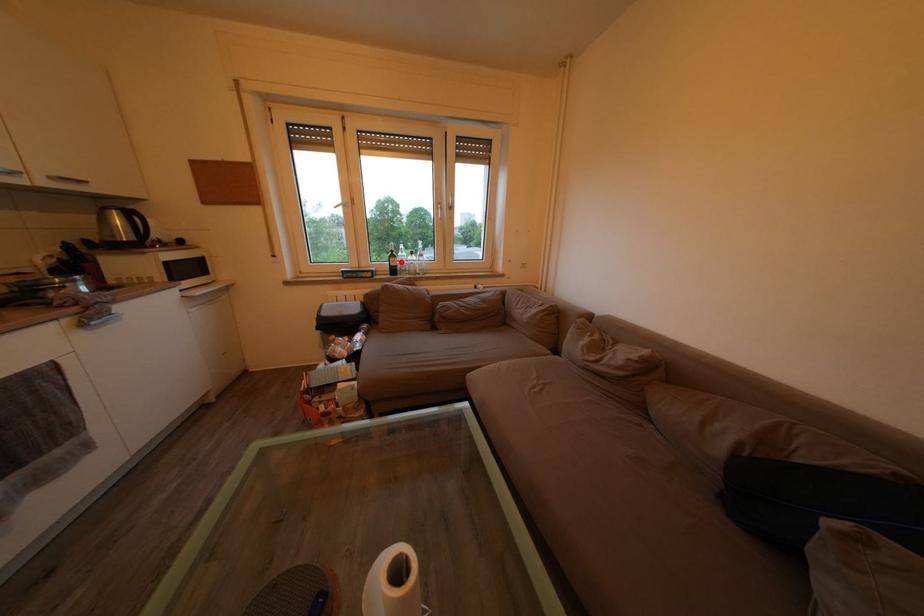
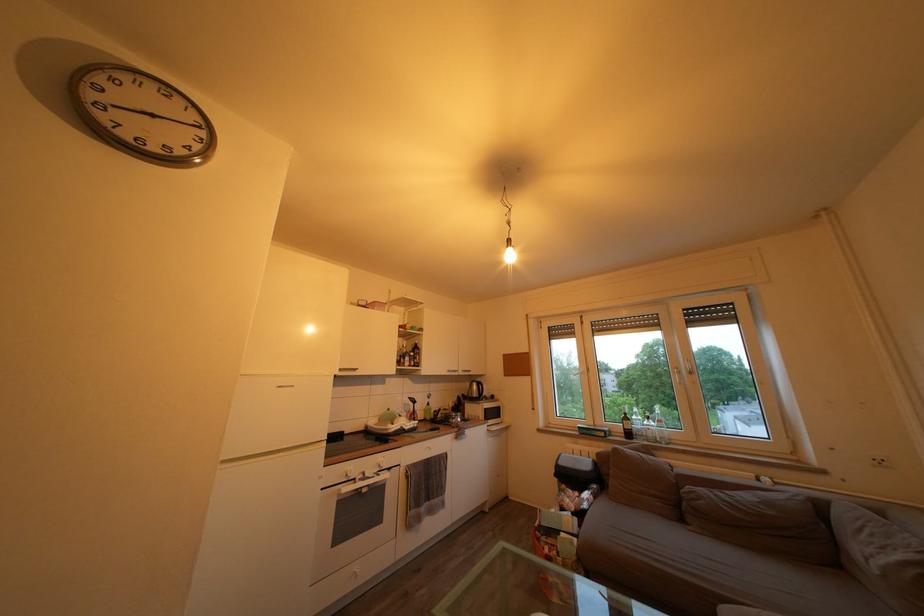
In the second image, find the point that corresponds to the highlighted location in the first image.

(635, 424)